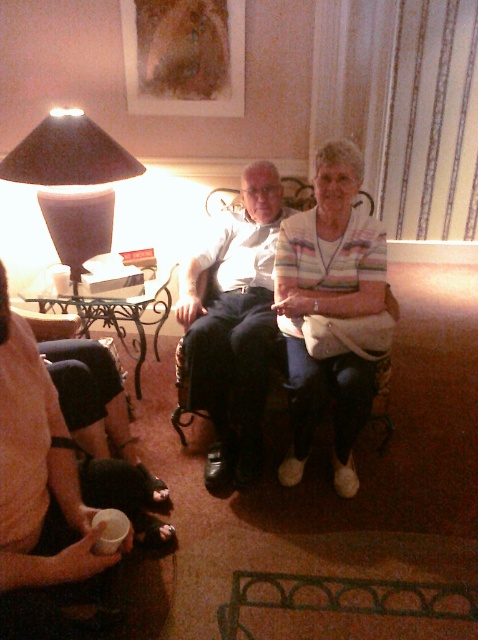
You are a guest in the living room and want to place a small gift on the table between the white striped sweater at center and the matte black lampshade at left. Which object should you place the gift closer to if you want it near the sweater?

You should place the gift closer to the white striped sweater at center because it is to the right of the matte black lampshade at left, so the sweater is farther from the lampshade and the gift can be positioned between them near the sweater.

You are a photographer trying to capture a closeup of the white striped sweater at center and the matte black lampshade at left. Which object should you focus on first if you want to ensure both are in focus without adjusting the camera settings?

You should focus on the white striped sweater at center first because it is closer to the viewer than the matte black lampshade at left, so focusing on the closer object will keep both in focus when using a shallow depth of field.